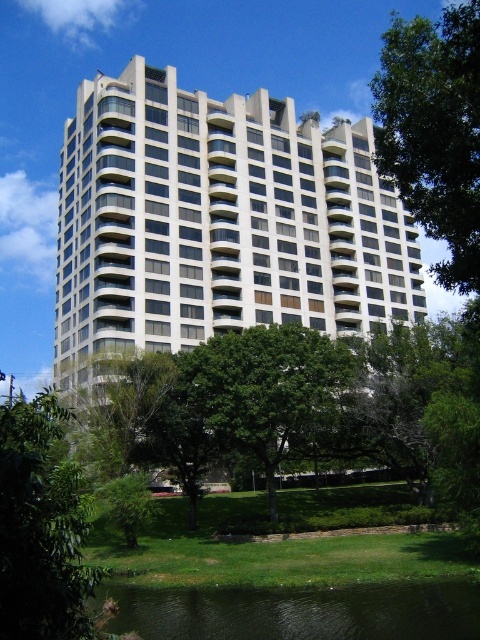
Question: Is the position of green leafy tree at upper right less distant than that of green leafy tree at center?

Choices:
 (A) yes
 (B) no

Answer: (A)

Question: Considering the real-world distances, which object is closest to the white glass building at center?

Choices:
 (A) green leafy tree at center
 (B) green liquid water at lower center
 (C) green leafy tree at upper right

Answer: (A)

Question: Which object appears closest to the camera in this image?

Choices:
 (A) white glass building at center
 (B) green leafy tree at upper right
 (C) green liquid water at lower center

Answer: (B)

Question: Can you confirm if green liquid water at lower center is positioned above green leafy tree at lower left?

Choices:
 (A) no
 (B) yes

Answer: (A)

Question: Does green liquid water at lower center appear on the right side of green leafy tree at center?

Choices:
 (A) yes
 (B) no

Answer: (B)

Question: Which of the following is the farthest from the observer?

Choices:
 (A) green liquid water at lower center
 (B) white glass building at center
 (C) green leafy tree at center

Answer: (C)